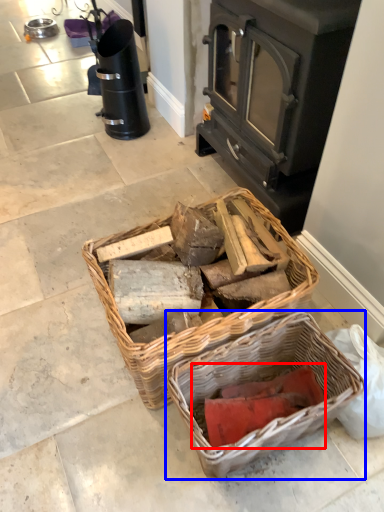
Question: Which of the following is the closest to the observer, debris (highlighted by a red box) or picnic basket (highlighted by a blue box)?

Choices:
 (A) debris
 (B) picnic basket

Answer: (B)